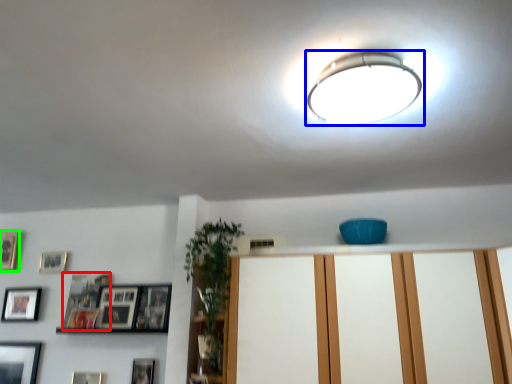
Question: Based on their relative distances, which object is farther from picture frame (highlighted by a red box)? Choose from lamp (highlighted by a blue box) and picture frame (highlighted by a green box).

Choices:
 (A) lamp
 (B) picture frame

Answer: (A)